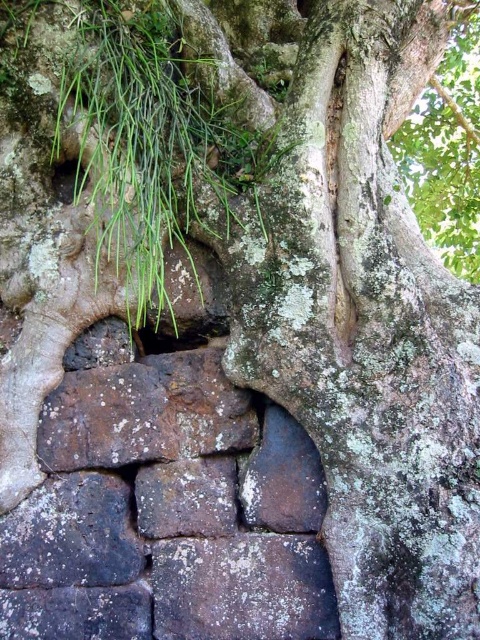
You are an archaeologist examining the ancient stone structure. You notice the gray rough stone at center and the black stone hole at center. Which of these two objects is higher up in the structure?

The gray rough stone at center is taller than the black stone hole at center, so the gray rough stone at center is higher up in the structure.

You are an archaeologist examining the ancient stone structure. You notice the gray rough stone at center and the black stone hole at center. Which object is positioned closer to your viewpoint?

The gray rough stone at center is closer to the viewer than the black stone hole at center.